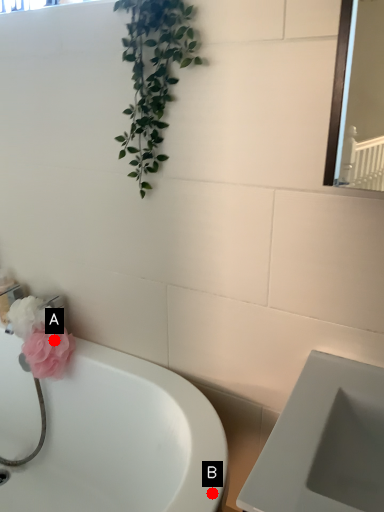
Question: Two points are circled on the image, labeled by A and B beside each circle. Which of the following is the farthest from the observer?

Choices:
 (A) A is further
 (B) B is further

Answer: (A)